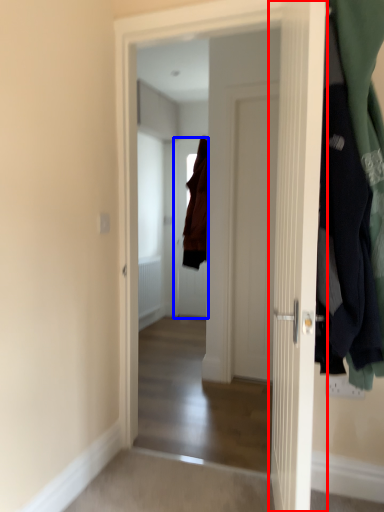
Question: Which point is closer to the camera, door (highlighted by a red box) or door (highlighted by a blue box)?

Choices:
 (A) door
 (B) door

Answer: (A)